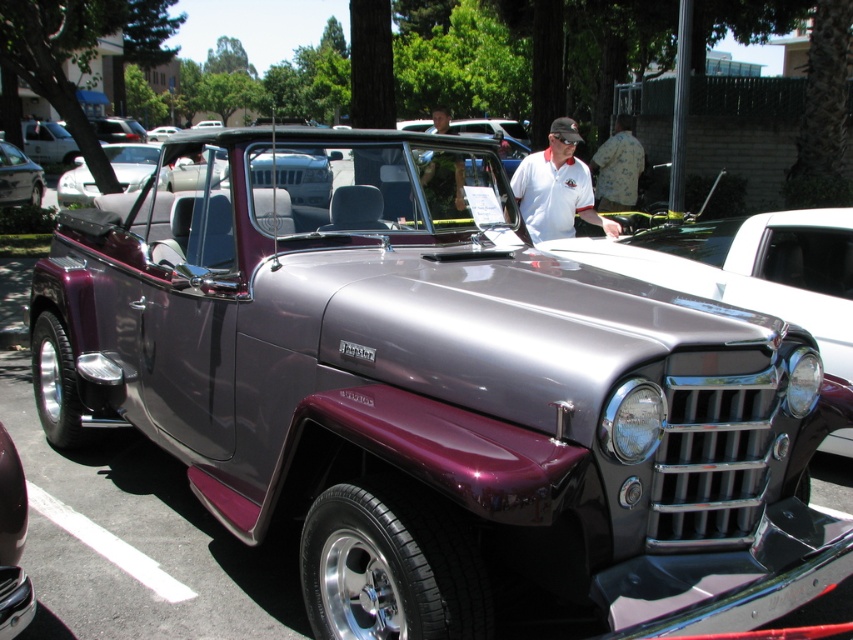
Question: Is metallic purple pickup truck at center above white cotton shirt at center?

Choices:
 (A) no
 (B) yes

Answer: (A)

Question: Among these points, which one is farthest from the camera?

Choices:
 (A) (425, 176)
 (B) (19, 164)
 (C) (525, 205)

Answer: (B)

Question: Which point is closer to the camera taking this photo?

Choices:
 (A) pos(447,188)
 (B) pos(566,225)

Answer: (A)

Question: Can you confirm if white cotton shirt at center is smaller than camouflage fabric shirt at center?

Choices:
 (A) yes
 (B) no

Answer: (A)

Question: Is white cotton shirt at center thinner than metallic silver car at center?

Choices:
 (A) no
 (B) yes

Answer: (B)

Question: Among these objects, which one is farthest from the camera?

Choices:
 (A) metallic purple pickup truck at center
 (B) white cotton shirt at center
 (C) metallic silver car at center
 (D) camouflage fabric shirt at center

Answer: (C)